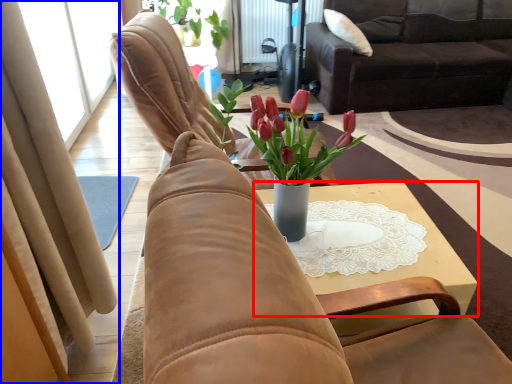
Question: Which object appears closest to the camera in this image, table (highlighted by a red box) or curtain (highlighted by a blue box)?

Choices:
 (A) table
 (B) curtain

Answer: (B)